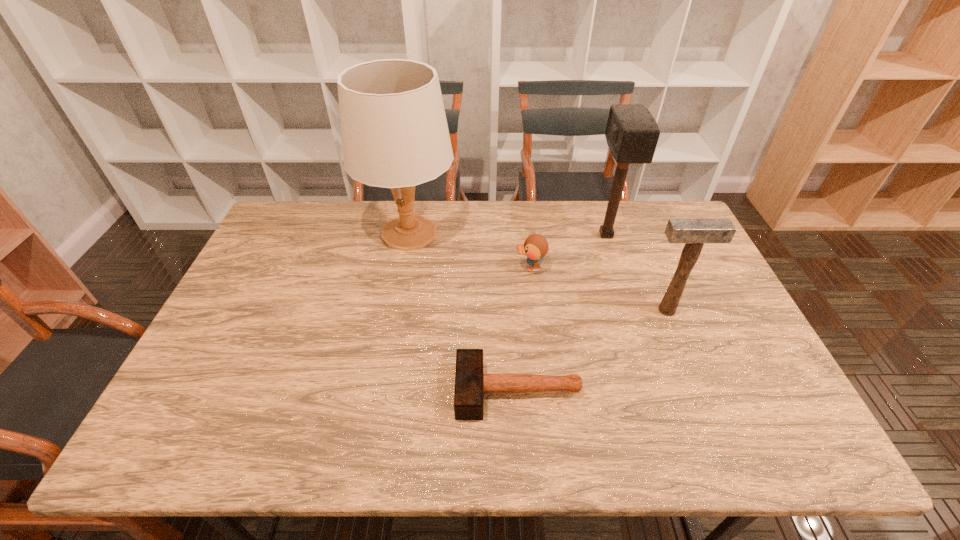
Locate which object ranks second in proximity to the table lamp. Please provide its 2D coordinates. Your answer should be formatted as a tuple, i.e. [(x, y)], where the tuple contains the x and y coordinates of a point satisfying the conditions above.

[(470, 383)]

Find the location of a particular element. The height and width of the screenshot is (540, 960). the third closest mallet to the table lamp is located at coordinates (694, 232).

Select which mallet appears as the closest to the duck. Please provide its 2D coordinates. Your answer should be formatted as a tuple, i.e. [(x, y)], where the tuple contains the x and y coordinates of a point satisfying the conditions above.

[(632, 133)]

Locate an element on the screen. free region that satisfies the following two spatial constraints: 1. on the front side of the farthest mallet; 2. on the left side of the third shortest object is located at coordinates (631, 310).

Where is `free space that satisfies the following two spatial constraints: 1. on the front side of the second tallest mallet; 2. on the hammer head face of the shortest object`? free space that satisfies the following two spatial constraints: 1. on the front side of the second tallest mallet; 2. on the hammer head face of the shortest object is located at coordinates (699, 391).

Find the location of a particular element. free space that satisfies the following two spatial constraints: 1. on the front side of the fourth shortest object; 2. on the front-facing side of the duck is located at coordinates [617, 268].